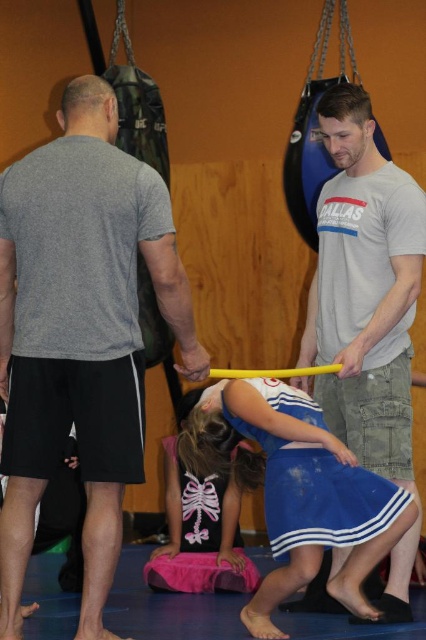
Question: Does matte gray t-shirt at center have a greater width compared to pink fabric at center?

Choices:
 (A) yes
 (B) no

Answer: (B)

Question: Is matte gray t-shirt at center thinner than pink fabric at center?

Choices:
 (A) no
 (B) yes

Answer: (B)

Question: Considering the real-world distances, which object is farthest from the matte gray t-shirt at center?

Choices:
 (A) pink fabric at center
 (B) gray matte t-shirt at left
 (C) blue cotton cheerleader skirt at lower center

Answer: (A)

Question: Is gray matte t-shirt at left positioned before matte gray t-shirt at center?

Choices:
 (A) no
 (B) yes

Answer: (B)

Question: Which of these objects is positioned farthest from the blue cotton cheerleader skirt at lower center?

Choices:
 (A) gray matte t-shirt at left
 (B) pink fabric at center
 (C) matte gray t-shirt at center

Answer: (B)

Question: Which is nearer to the pink fabric at center?

Choices:
 (A) blue cotton cheerleader skirt at lower center
 (B) matte gray t-shirt at center
 (C) gray matte t-shirt at left

Answer: (A)